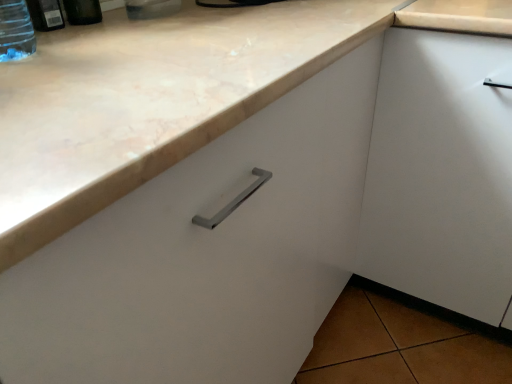
Question: Considering the relative sizes of transparent plastic bottle at upper left, which ranks as the third bottle in right-to-left order, and matte plastic bottle at upper left, the first bottle in the right-to-left sequence, in the image provided, is transparent plastic bottle at upper left, which ranks as the third bottle in right-to-left order, bigger than matte plastic bottle at upper left, the first bottle in the right-to-left sequence,?

Choices:
 (A) no
 (B) yes

Answer: (A)

Question: Considering the relative sizes of transparent plastic bottle at upper left, the first bottle in the left-to-right sequence, and matte plastic bottle at upper left, the first bottle in the right-to-left sequence, in the image provided, is transparent plastic bottle at upper left, the first bottle in the left-to-right sequence, thinner than matte plastic bottle at upper left, the first bottle in the right-to-left sequence,?

Choices:
 (A) no
 (B) yes

Answer: (B)

Question: Can you confirm if transparent plastic bottle at upper left, which ranks as the third bottle in right-to-left order, is positioned to the left of matte plastic bottle at upper left, the 3th bottle positioned from the left?

Choices:
 (A) no
 (B) yes

Answer: (B)

Question: Is transparent plastic bottle at upper left, which ranks as the third bottle in right-to-left order, further to the viewer compared to matte plastic bottle at upper left, the first bottle in the right-to-left sequence?

Choices:
 (A) no
 (B) yes

Answer: (A)

Question: From a real-world perspective, does transparent plastic bottle at upper left, the first bottle in the left-to-right sequence, sit lower than matte plastic bottle at upper left, the first bottle in the right-to-left sequence?

Choices:
 (A) yes
 (B) no

Answer: (A)

Question: From a real-world perspective, is transparent plastic bottle at upper left, the first bottle in the left-to-right sequence, physically above matte plastic bottle at upper left, the first bottle in the right-to-left sequence?

Choices:
 (A) no
 (B) yes

Answer: (A)

Question: Considering the relative sizes of marble countertop at upper left and matte plastic bottle at upper left, the 3th bottle positioned from the left, in the image provided, is marble countertop at upper left bigger than matte plastic bottle at upper left, the 3th bottle positioned from the left,?

Choices:
 (A) yes
 (B) no

Answer: (A)

Question: From a real-world perspective, is marble countertop at upper left physically below matte plastic bottle at upper left, the first bottle in the right-to-left sequence?

Choices:
 (A) no
 (B) yes

Answer: (B)

Question: From a real-world perspective, is marble countertop at upper left on matte plastic bottle at upper left, the first bottle in the right-to-left sequence?

Choices:
 (A) no
 (B) yes

Answer: (A)

Question: Considering the relative sizes of marble countertop at upper left and matte plastic bottle at upper left, the first bottle in the right-to-left sequence, in the image provided, is marble countertop at upper left thinner than matte plastic bottle at upper left, the first bottle in the right-to-left sequence,?

Choices:
 (A) no
 (B) yes

Answer: (A)

Question: Can you confirm if marble countertop at upper left is wider than matte plastic bottle at upper left, the first bottle in the right-to-left sequence?

Choices:
 (A) no
 (B) yes

Answer: (B)

Question: Is marble countertop at upper left oriented towards matte plastic bottle at upper left, the 3th bottle positioned from the left?

Choices:
 (A) yes
 (B) no

Answer: (B)

Question: Is marble countertop at upper left bigger than transparent plastic bottle at upper left, placed as the second bottle when sorted from right to left?

Choices:
 (A) yes
 (B) no

Answer: (A)